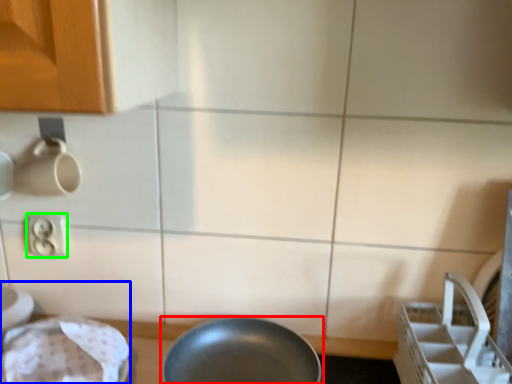
Question: Based on their relative distances, which object is nearer to frying pan (highlighted by a red box)? Choose from sink (highlighted by a blue box) and electric outlet (highlighted by a green box).

Choices:
 (A) sink
 (B) electric outlet

Answer: (A)